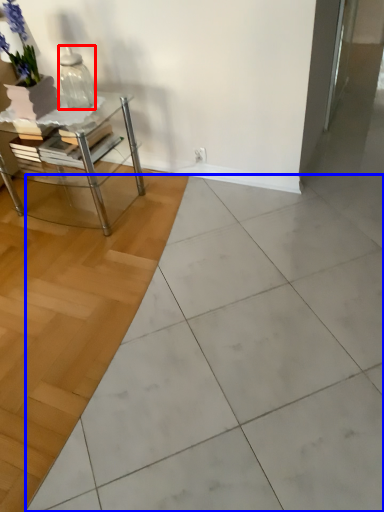
Question: Which of the following is the farthest to the observer, vase (highlighted by a red box) or ceramic tile (highlighted by a blue box)?

Choices:
 (A) vase
 (B) ceramic tile

Answer: (A)